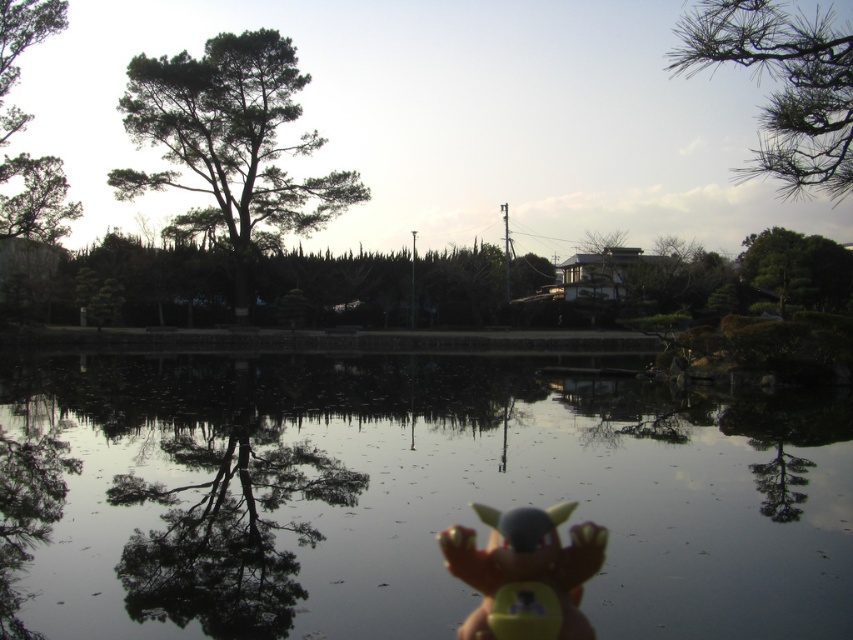
Question: Which of the following is the closest to the observer?

Choices:
 (A) matte yellow toy at bottom center
 (B) green matte tree at upper left
 (C) green needle-like branches at upper right

Answer: (A)

Question: Can you confirm if transparent water at center is thinner than matte yellow toy at bottom center?

Choices:
 (A) no
 (B) yes

Answer: (A)

Question: Considering the real-world distances, which object is farthest from the matte yellow toy at bottom center?

Choices:
 (A) transparent water at center
 (B) green leafy tree at upper left

Answer: (B)

Question: Among these objects, which one is nearest to the camera?

Choices:
 (A) green matte tree at upper left
 (B) matte yellow toy at bottom center

Answer: (B)

Question: Does green leafy tree at upper left have a greater width compared to green needle-like branches at upper right?

Choices:
 (A) yes
 (B) no

Answer: (B)

Question: Does green needle-like branches at upper right lie in front of matte yellow toy at bottom center?

Choices:
 (A) yes
 (B) no

Answer: (B)